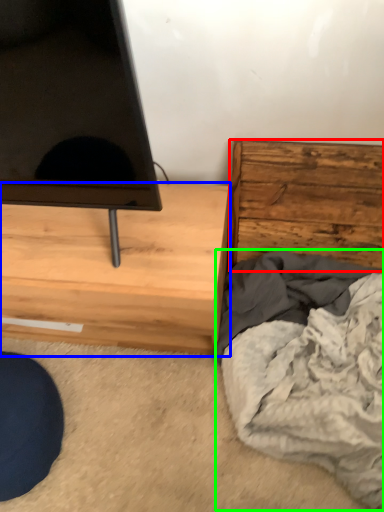
Question: Considering the real-world distances, which object is farthest from chest of drawers (highlighted by a red box)? chest of drawers (highlighted by a blue box) or blanket (highlighted by a green box)?

Choices:
 (A) chest of drawers
 (B) blanket

Answer: (A)